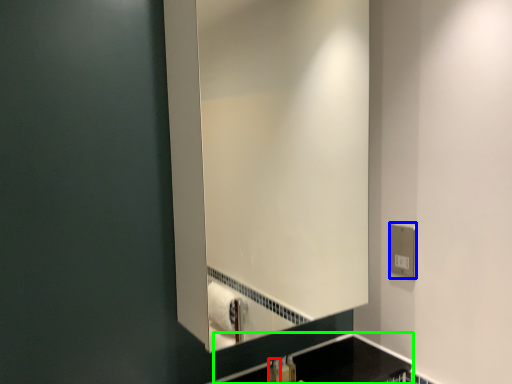
Question: Estimate the real-world distances between objects in this image. Which object is closer to toiletry (highlighted by a red box), electric outlet (highlighted by a blue box) or counter top (highlighted by a green box)?

Choices:
 (A) electric outlet
 (B) counter top

Answer: (B)